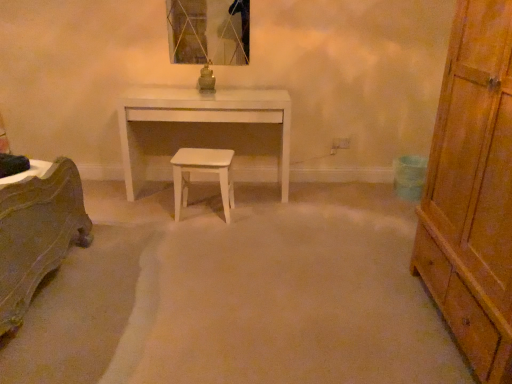
Measure the distance between metallic glass mirror at upper center and camera.

3.06 meters.

Find the location of `metallic glass mirror at upper center`. metallic glass mirror at upper center is located at coordinates (209, 31).

Is wooden chest of drawers at right wider than white glossy desk at center?

Correct, the width of wooden chest of drawers at right exceeds that of white glossy desk at center.

Where is `desk below the wooden chest of drawers at right (from a real-world perspective)`? The image size is (512, 384). desk below the wooden chest of drawers at right (from a real-world perspective) is located at coordinates [x=200, y=120].

Which of these two, wooden chest of drawers at right or white glossy desk at center, is bigger?

wooden chest of drawers at right.

From the image's perspective, is wooden chest of drawers at right on top of white glossy desk at center?

No, from the image's perspective, wooden chest of drawers at right is not above white glossy desk at center.

Considering the sizes of objects wooden chest of drawers at right and metallic glass mirror at upper center in the image provided, who is wider, wooden chest of drawers at right or metallic glass mirror at upper center?

With larger width is wooden chest of drawers at right.

Is metallic glass mirror at upper center inside wooden chest of drawers at right?

No, wooden chest of drawers at right does not contain metallic glass mirror at upper center.

From a real-world perspective, is wooden chest of drawers at right physically above metallic glass mirror at upper center?

No, from a real-world perspective, wooden chest of drawers at right is not over metallic glass mirror at upper center

Is metallic glass mirror at upper center at the back of wooden chest of drawers at right?

That's not correct — wooden chest of drawers at right is not looking away from metallic glass mirror at upper center.

Based on the photo, between metallic glass mirror at upper center and white matte stool at center, which one appears on the right side from the viewer's perspective?

Positioned to the right is white matte stool at center.

From the image's perspective, is metallic glass mirror at upper center located above or below white matte stool at center?

metallic glass mirror at upper center is above white matte stool at center.

Measure the distance between metallic glass mirror at upper center and white matte stool at center.

metallic glass mirror at upper center is 36.27 inches away from white matte stool at center.

Who is smaller, metallic glass mirror at upper center or white matte stool at center?

With smaller size is metallic glass mirror at upper center.

Is white glossy desk at center thinner than metallic glass mirror at upper center?

No, white glossy desk at center is not thinner than metallic glass mirror at upper center.

Is white glossy desk at center in contact with metallic glass mirror at upper center?

white glossy desk at center is not next to metallic glass mirror at upper center, and they're not touching.

Can you tell me how much white glossy desk at center and metallic glass mirror at upper center differ in facing direction?

The facing directions of white glossy desk at center and metallic glass mirror at upper center are 0.695 degrees apart.

Between white glossy desk at center and metallic glass mirror at upper center, which one has more height?

white glossy desk at center is taller.

Which of these two, white glossy desk at center or wooden chest of drawers at right, is bigger?

With larger size is wooden chest of drawers at right.

How far apart are white glossy desk at center and wooden chest of drawers at right?

The distance of white glossy desk at center from wooden chest of drawers at right is 1.61 meters.

Which point is more distant from viewer, (187, 105) or (473, 226)?

The point (187, 105) is farther from the camera.

From a real-world perspective, which is physically above, white glossy desk at center or wooden chest of drawers at right?

From a 3D spatial view, wooden chest of drawers at right is above.

Is metallic glass mirror at upper center facing away from white glossy desk at center?

No, white glossy desk at center is not at the back of metallic glass mirror at upper center.

From the image's perspective, which is below, metallic glass mirror at upper center or white glossy desk at center?

white glossy desk at center appears lower in the image.

Which is in front, point (245, 24) or point (273, 111)?

Point (273, 111)

Is metallic glass mirror at upper center not within white glossy desk at center?

Yes, metallic glass mirror at upper center is located beyond the bounds of white glossy desk at center.

From a real-world perspective, between wooden chest of drawers at right and white matte stool at center, who is vertically lower?

white matte stool at center is physically lower.

Can you confirm if wooden chest of drawers at right is thinner than white matte stool at center?

No.

Between point (490, 377) and point (192, 169), which one is positioned in front?

The point (490, 377) is closer.

Identify the location of desk located behind the wooden chest of drawers at right. This screenshot has width=512, height=384. (200, 120).

Find the location of a particular element. This screenshot has height=384, width=512. mirror above the wooden chest of drawers at right (from the image's perspective) is located at coordinates (209, 31).

Based on their spatial positions, is white matte stool at center or wooden chest of drawers at right closer to white glossy desk at center?

white matte stool at center.

In the scene shown: Based on their spatial positions, is wooden chest of drawers at right or white matte stool at center closer to metallic glass mirror at upper center?

Among the two, white matte stool at center is located nearer to metallic glass mirror at upper center.

Estimate the real-world distances between objects in this image. Which object is closer to metallic glass mirror at upper center, white matte stool at center or white glossy desk at center?

Among the two, white glossy desk at center is located nearer to metallic glass mirror at upper center.

From the image, which object appears to be nearer to white glossy desk at center, wooden chest of drawers at right or white matte stool at center?

white matte stool at center lies closer to white glossy desk at center than the other object.

Based on their spatial positions, is white matte stool at center or white glossy desk at center further from wooden chest of drawers at right?

The object further to wooden chest of drawers at right is white glossy desk at center.

Considering their positions, is white matte stool at center positioned closer to metallic glass mirror at upper center than wooden chest of drawers at right?

The object closer to metallic glass mirror at upper center is white matte stool at center.

Based on their spatial positions, is white matte stool at center or metallic glass mirror at upper center further from wooden chest of drawers at right?

metallic glass mirror at upper center is further to wooden chest of drawers at right.

From the image, which object appears to be nearer to white glossy desk at center, metallic glass mirror at upper center or white matte stool at center?

white matte stool at center is positioned closer to the anchor white glossy desk at center.

Where is `desk positioned between wooden chest of drawers at right and metallic glass mirror at upper center from near to far`? desk positioned between wooden chest of drawers at right and metallic glass mirror at upper center from near to far is located at coordinates (200, 120).

Locate an element on the screen. desk between metallic glass mirror at upper center and white matte stool at center vertically is located at coordinates (200, 120).

Locate an element on the screen. This screenshot has width=512, height=384. stool between wooden chest of drawers at right and metallic glass mirror at upper center from front to back is located at coordinates (202, 171).

At what (x,y) coordinates should I click in order to perform the action: click on stool positioned between wooden chest of drawers at right and white glossy desk at center from near to far. Please return your answer as a coordinate pair (x, y). Looking at the image, I should click on (x=202, y=171).